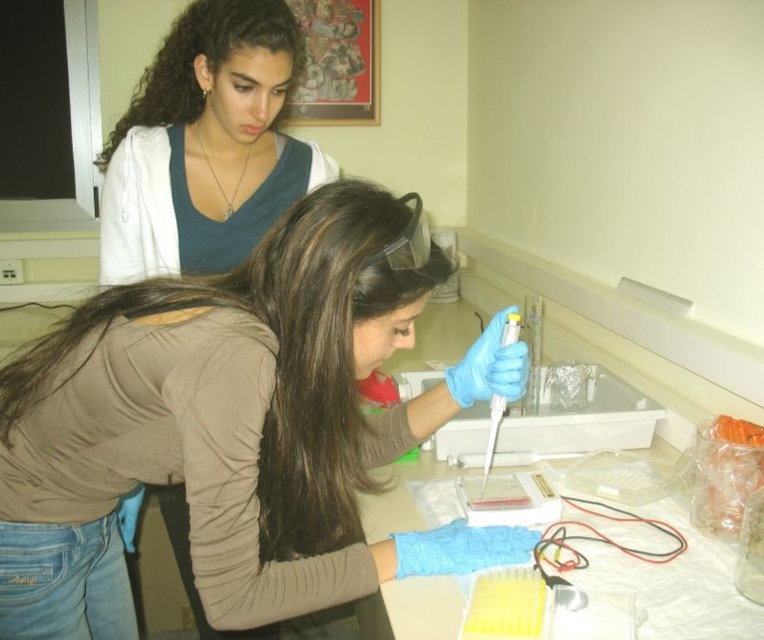
You are a new lab assistant who just entered the lab and need to take a photo of the experiment setup. The camera is placed at the upper right corner of the lab table. You are wearing a matte blue shirt at upper left. Can you reach the camera from your current position without moving your feet?

The matte blue shirt at upper left and camera are 1.25 meters apart from each other. Since the distance is 1.25 meters, you cannot reach the camera without moving your feet as the distance is too far for typical arm reach.

You are a lab assistant who needs to place a small sticker at point (x=206, y=145). Based on the scene, where exactly would this sticker be placed?

The point (x=206, y=145) is on the matte blue shirt at upper left, so the sticker would be placed on the matte blue shirt at upper left.

You are a researcher in the lab and need to locate two specific points marked on the table. The first point is at coordinates point (337,387) and the second is at point (481,490). From your perspective standing at the edge of the table, which point is closer to you?

Point (337,387) is in front of point (481,490), so it is closer to you.